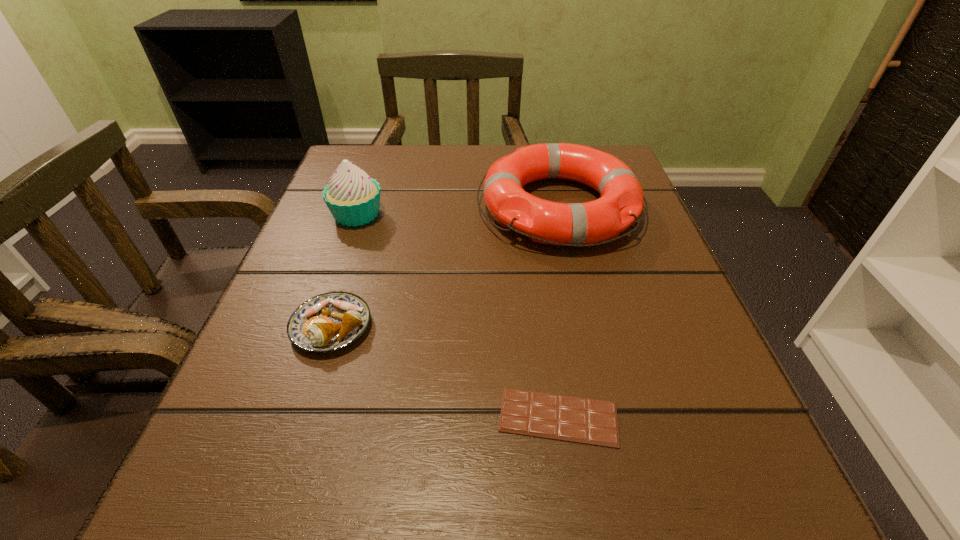
Locate an element on the screen. Image resolution: width=960 pixels, height=540 pixels. the tallest object is located at coordinates (353, 198).

Where is `the third shortest object`? The image size is (960, 540). the third shortest object is located at coordinates (575, 224).

The image size is (960, 540). Find the location of `the third farthest object`. the third farthest object is located at coordinates (328, 322).

This screenshot has height=540, width=960. Find the location of `pastry`. pastry is located at coordinates (328, 322).

This screenshot has height=540, width=960. What are the coordinates of `the shortest object` in the screenshot? It's located at (580, 420).

I want to click on the nearest object, so click(x=580, y=420).

Identify the location of free space located on the right of the cupcake. The height and width of the screenshot is (540, 960). (516, 215).

Find the location of a particular element. This screenshot has height=540, width=960. blank space located on the left of the life buoy is located at coordinates (413, 207).

You are a GUI agent. You are given a task and a screenshot of the screen. Output one action in this format:
    pyautogui.click(x=<x>, y=<y>)
    Task: Click on the free space located 0.360m on the back of the third tallest object
    The image size is (960, 540).
    Given the screenshot: What is the action you would take?
    pyautogui.click(x=378, y=180)

You are a GUI agent. You are given a task and a screenshot of the screen. Output one action in this format:
    pyautogui.click(x=<x>, y=<y>)
    Task: Click on the free spot located 0.360m on the back of the shortest object
    The width and height of the screenshot is (960, 540).
    Given the screenshot: What is the action you would take?
    pyautogui.click(x=531, y=226)